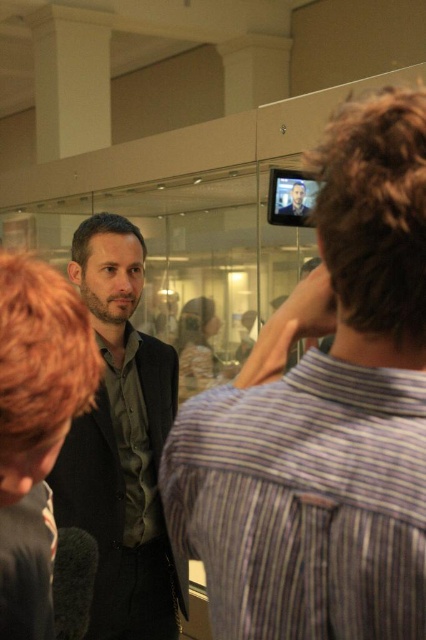
Question: Estimate the real-world distances between objects in this image. Which object is closer to the black plastic video camera at upper center?

Choices:
 (A) matte black shirt at left
 (B) matte black face at center
 (C) dark gray suit at center

Answer: (B)

Question: Considering the relative positions of dark gray suit at center and black plastic video camera at upper center in the image provided, where is dark gray suit at center located with respect to black plastic video camera at upper center?

Choices:
 (A) left
 (B) right

Answer: (A)

Question: Observing the image, what is the correct spatial positioning of matte black shirt at left in reference to black plastic video camera at upper center?

Choices:
 (A) above
 (B) below

Answer: (B)

Question: Can you confirm if matte black shirt at left is positioned to the right of dark gray suit at center?

Choices:
 (A) yes
 (B) no

Answer: (A)

Question: Which is nearer to the black plastic video camera at upper center?

Choices:
 (A) dark gray suit at center
 (B) matte black shirt at left

Answer: (A)

Question: Which point appears closest to the camera in this image?

Choices:
 (A) (356, 253)
 (B) (298, 189)

Answer: (A)